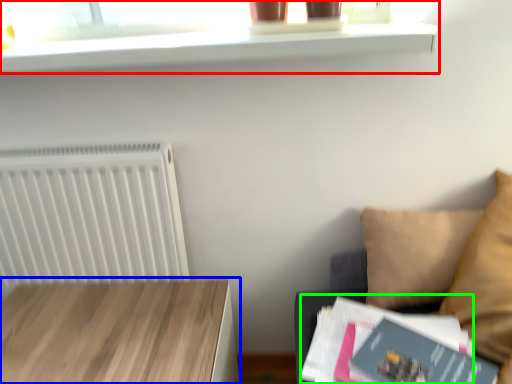
Question: Considering the real-world distances, which object is closest to shelf (highlighted by a red box)? table (highlighted by a blue box) or paperback book (highlighted by a green box).

Choices:
 (A) table
 (B) paperback book

Answer: (A)